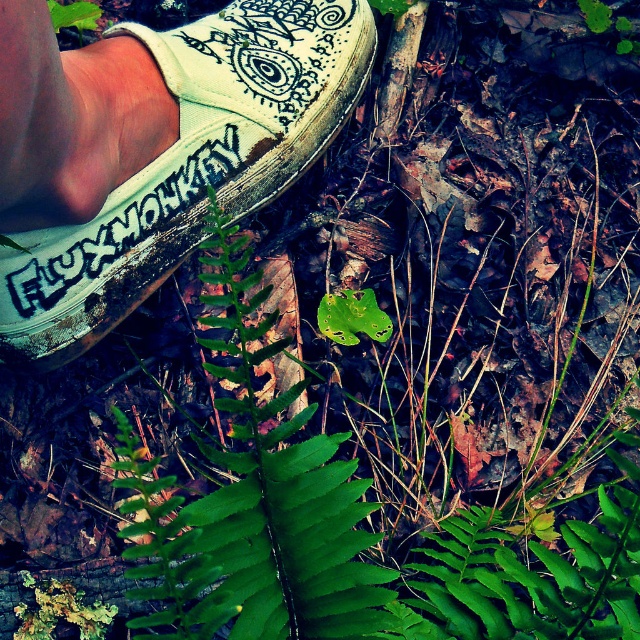
Is white canvas shoe at center to the right of black painted text at lower left from the viewer's perspective?

Correct, you'll find white canvas shoe at center to the right of black painted text at lower left.

Between white canvas shoe at center and black painted text at lower left, which one has more height?

Standing taller between the two is white canvas shoe at center.

Is point (138, 276) farther from camera compared to point (138, 220)?

Yes.

Image resolution: width=640 pixels, height=640 pixels. I want to click on white canvas shoe at center, so click(152, 148).

Which is more to the right, green leafy fern at center or black painted text at lower left?

green leafy fern at center

Is point (234, 304) farther from viewer compared to point (134, 225)?

No, (234, 304) is in front of (134, 225).

Locate an element on the screen. This screenshot has height=640, width=640. green leafy fern at center is located at coordinates (264, 499).

Can you confirm if white canvas shoe at center is positioned to the right of green leafy fern at center?

No, white canvas shoe at center is not to the right of green leafy fern at center.

Does point (13, 1) lie in front of point (252, 369)?

Yes.

Locate an element on the screen. This screenshot has height=640, width=640. white canvas shoe at center is located at coordinates (152, 148).